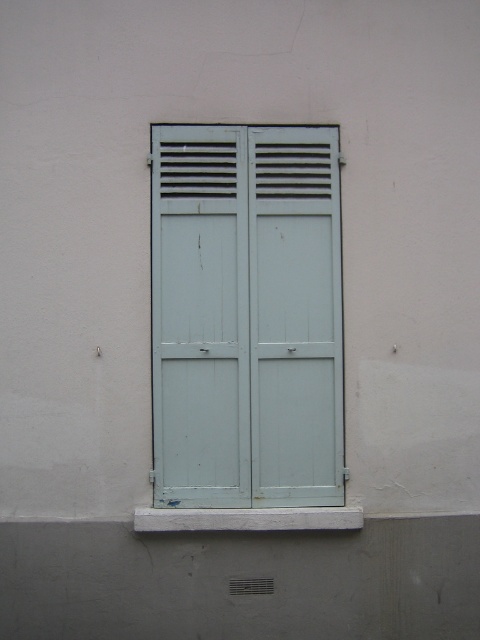
You are standing in front of a building with a light blue wood door at center. You want to reach the door but there is a 5.5 meter long rope ladder available. Can you use it to reach the door?

The light blue wood door at center is 5.75 meters away from viewer. The rope ladder is 5.5 meters long, which is shorter than the required distance. Therefore, the rope ladder is insufficient to reach the door.

You are standing in front of the building and looking at the window with shutters. There are two points marked on the wall at coordinates point (167, 193) and point (203, 337). Which point is closer to you?

Point (167, 193) is closer to the camera than point (203, 337).

You are standing in front of a building and see the light blue wood shutters at center and the light blue wooden door at center. Which one is more to the left?

The light blue wood shutters at center is positioned on the left side of light blue wooden door at center, so it is more to the left.